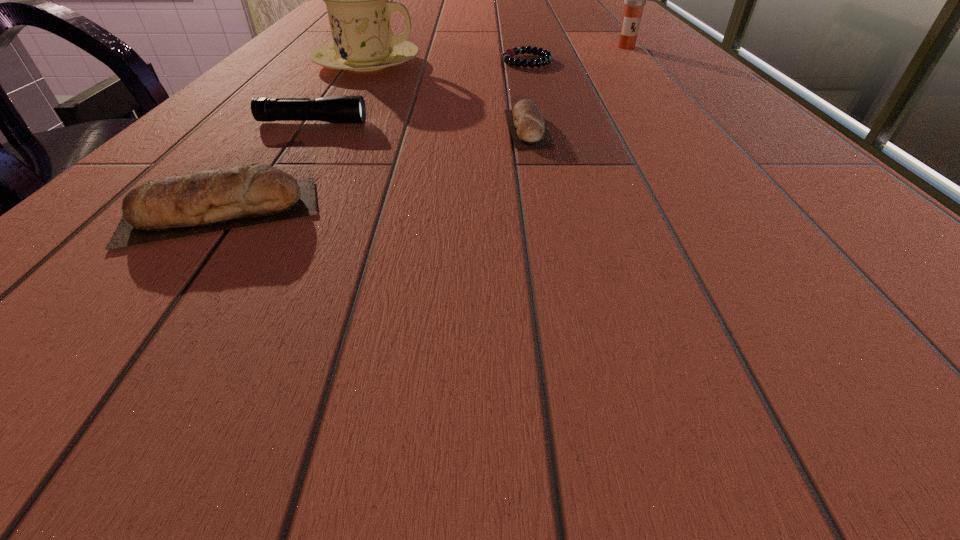
Where is `free space between the flashlight and the fifth tallest object`? The image size is (960, 540). free space between the flashlight and the fifth tallest object is located at coordinates (420, 125).

Locate an element on the screen. The image size is (960, 540). vacant area that lies between the farther pita bread and the chinaware is located at coordinates (447, 96).

This screenshot has height=540, width=960. I want to click on free space between the left pita bread and the farther pita bread, so click(x=374, y=171).

Where is `free spot between the medicine and the flashlight`? The width and height of the screenshot is (960, 540). free spot between the medicine and the flashlight is located at coordinates click(469, 85).

The height and width of the screenshot is (540, 960). Identify the location of empty space between the rightmost object and the farther pita bread. (577, 87).

I want to click on object that is the second closest to the bracelet, so click(357, 0).

Locate which object ranks fourth in proximity to the medicine. Please provide its 2D coordinates. Your answer should be formatted as a tuple, i.e. [(x, y)], where the tuple contains the x and y coordinates of a point satisfying the conditions above.

[(347, 109)]

Find the location of a particular element. Image resolution: width=960 pixels, height=540 pixels. vacant region that satisfies the following two spatial constraints: 1. on the label side of the medicine; 2. on the handle side of the chinaware is located at coordinates (640, 63).

You are a GUI agent. You are given a task and a screenshot of the screen. Output one action in this format:
    pyautogui.click(x=<x>, y=<y>)
    Task: Click on the free space that satisfies the following two spatial constraints: 1. on the label side of the medicine; 2. at the lens end of the flashlight
    
    Given the screenshot: What is the action you would take?
    pyautogui.click(x=692, y=123)

Find the location of a particular element. Image resolution: width=960 pixels, height=540 pixels. free space that satisfies the following two spatial constraints: 1. on the label side of the medicine; 2. at the lens end of the flashlight is located at coordinates (692, 123).